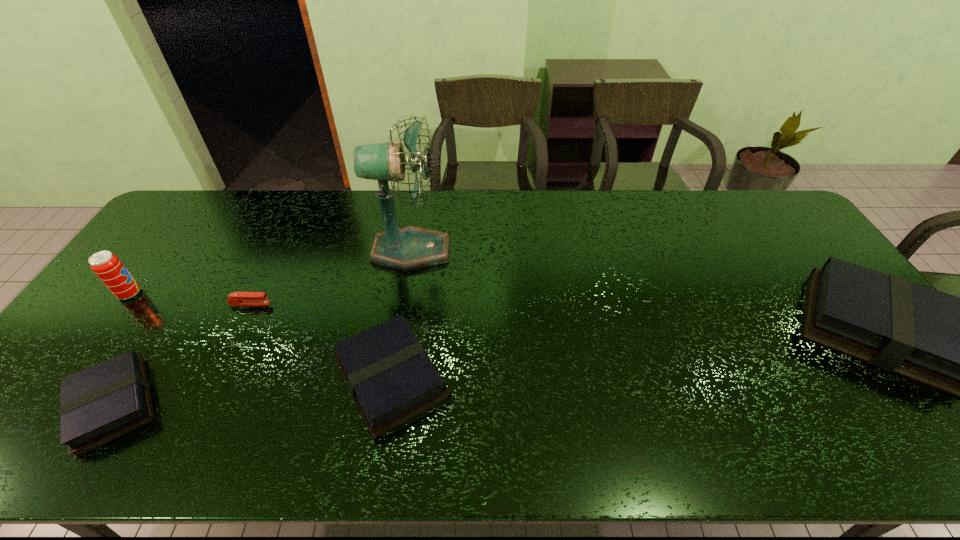
Identify the location of vacant space at the right edge of the desktop. This screenshot has height=540, width=960. (767, 234).

The width and height of the screenshot is (960, 540). In order to click on free space at the near right corner of the desktop in this screenshot , I will do `click(888, 387)`.

You are a GUI agent. You are given a task and a screenshot of the screen. Output one action in this format:
    pyautogui.click(x=<x>, y=<y>)
    Task: Click on the free space between the second shortest book and the leftmost object
    
    Given the screenshot: What is the action you would take?
    pyautogui.click(x=261, y=336)

Find the location of a particular element. The image size is (960, 540). free space between the fifth shortest object and the tallest object is located at coordinates (271, 272).

At what (x,y) coordinates should I click in order to perform the action: click on free space between the tallest object and the second shortest book. Please return your answer as a coordinate pair (x, y). Looking at the image, I should click on (401, 314).

Locate an element on the screen. This screenshot has width=960, height=540. empty space between the tallest object and the leftmost object is located at coordinates (271, 272).

The height and width of the screenshot is (540, 960). I want to click on vacant space in between the third shortest object and the stapler, so coord(321,341).

Where is `unoccupied area between the leftmost book and the tallest object`? The width and height of the screenshot is (960, 540). unoccupied area between the leftmost book and the tallest object is located at coordinates coord(262,328).

The width and height of the screenshot is (960, 540). Identify the location of free space between the leftmost object and the second book from right to left. (261, 336).

Find the location of `free spot between the leftmost book and the leftmost object`. free spot between the leftmost book and the leftmost object is located at coordinates (122, 349).